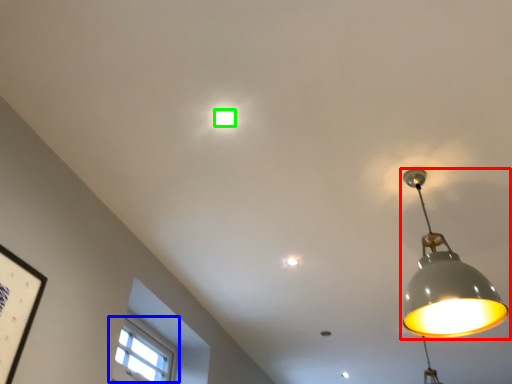
Question: Based on their relative distances, which object is nearer to lamp (highlighted by a red box)? Choose from window (highlighted by a blue box) and lamp (highlighted by a green box).

Choices:
 (A) window
 (B) lamp

Answer: (B)